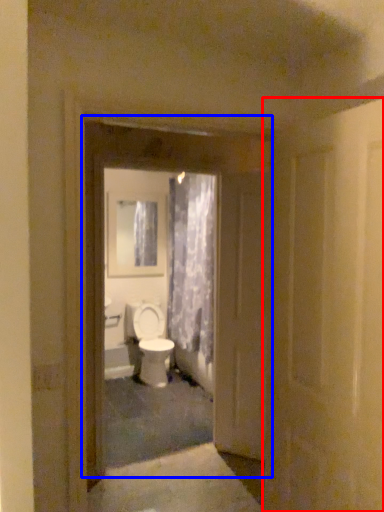
Question: Which object appears farthest to the camera in this image, door (highlighted by a red box) or door (highlighted by a blue box)?

Choices:
 (A) door
 (B) door

Answer: (B)